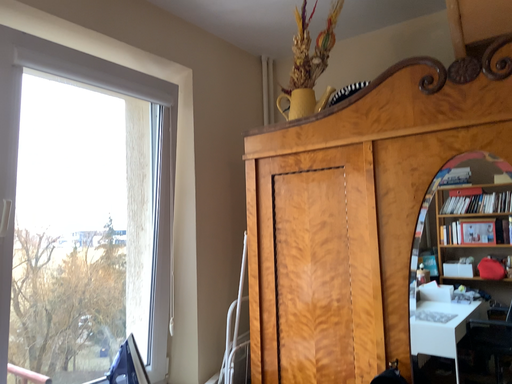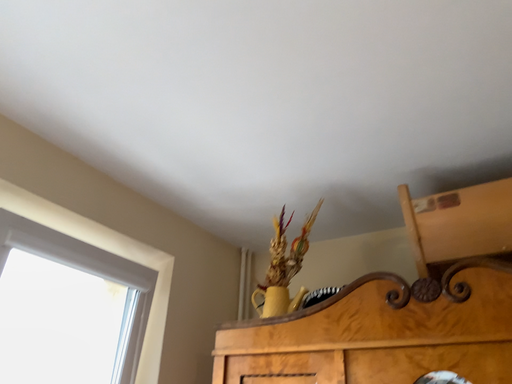
Question: Which way did the camera rotate in the video?

Choices:
 (A) rotated downward
 (B) rotated upward

Answer: (B)